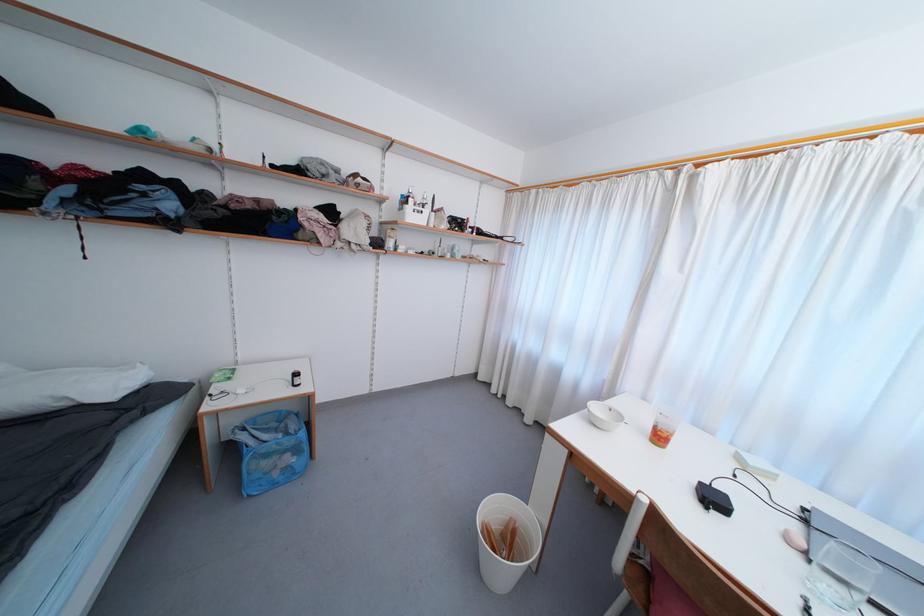
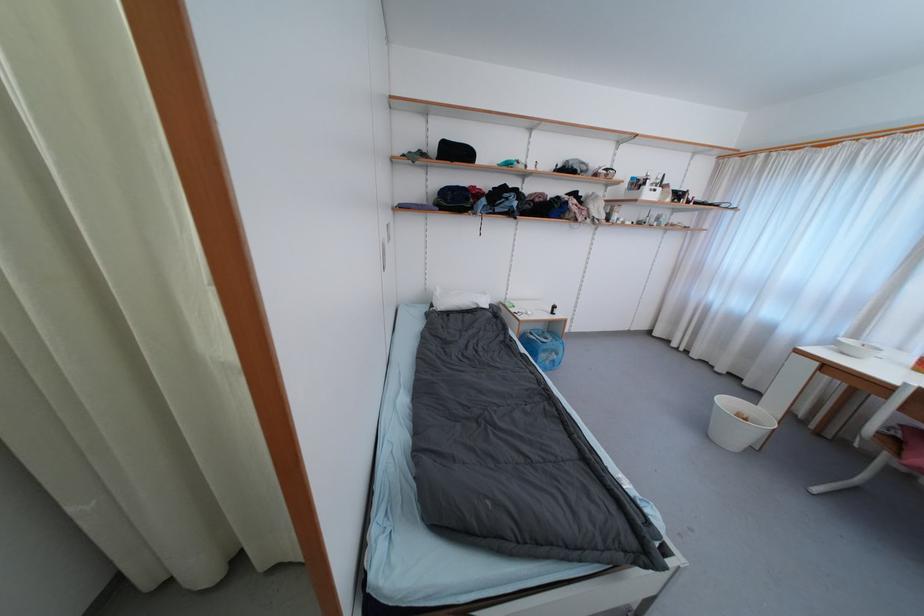
Find the pixel in the second image that matches pixel 138 371 in the first image.

(489, 296)